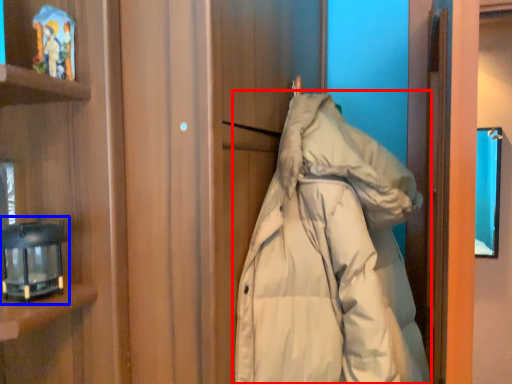
Question: Which object is closer to the camera taking this photo, jacket (highlighted by a red box) or lamp (highlighted by a blue box)?

Choices:
 (A) jacket
 (B) lamp

Answer: (A)